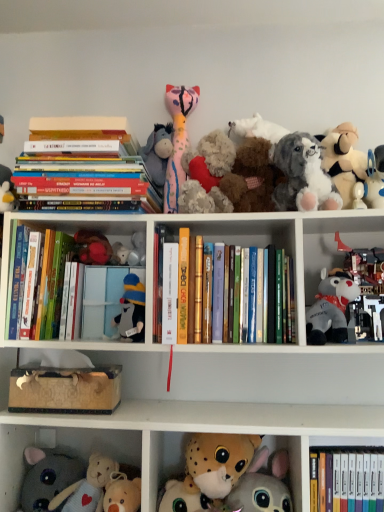
Question: From a real-world perspective, is hardcover book at center, marked as the 2th paperback book in a right-to-left arrangement, located higher than gray plush toy at right, which ranks as the 2th toy in right-to-left order?

Choices:
 (A) no
 (B) yes

Answer: (B)

Question: Is hardcover book at center, which is the first paperback book in left-to-right order, closer to camera compared to gray plush toy at right, which ranks as the 2th toy in right-to-left order?

Choices:
 (A) yes
 (B) no

Answer: (B)

Question: Are hardcover book at center, marked as the 2th paperback book in a right-to-left arrangement, and gray plush toy at right, arranged as the eighth toy when viewed from the left, located far from each other?

Choices:
 (A) no
 (B) yes

Answer: (A)

Question: Is hardcover book at center, marked as the 2th paperback book in a right-to-left arrangement, oriented away from gray plush toy at right, which ranks as the 2th toy in right-to-left order?

Choices:
 (A) yes
 (B) no

Answer: (B)

Question: Does hardcover book at center, which is the first paperback book in left-to-right order, have a greater width compared to gray plush toy at right, arranged as the eighth toy when viewed from the left?

Choices:
 (A) yes
 (B) no

Answer: (A)

Question: From the image's perspective, is hardcover books at center above or below white plush toy at upper right, which is counted as the second cabinet, starting from the left?

Choices:
 (A) above
 (B) below

Answer: (A)

Question: Would you say hardcover books at center is inside or outside white plush toy at upper right, the first cabinet from the right?

Choices:
 (A) inside
 (B) outside

Answer: (B)

Question: From a real-world perspective, is hardcover books at center positioned above or below white plush toy at upper right, the first cabinet in the top-to-bottom sequence?

Choices:
 (A) above
 (B) below

Answer: (A)

Question: In terms of height, does hardcover books at center look taller or shorter compared to white plush toy at upper right, the first cabinet from the right?

Choices:
 (A) tall
 (B) short

Answer: (A)

Question: Is fluffy white plush at lower center, the fifth toy when ordered from left to right, wider or thinner than hardcover books at center, the 2th book viewed from the right?

Choices:
 (A) thin
 (B) wide

Answer: (A)

Question: Is fluffy white plush at lower center, which is the fifth toy from right to left, in front of or behind hardcover books at center, which is the third book from left to right, in the image?

Choices:
 (A) behind
 (B) front

Answer: (A)

Question: From a real-world perspective, relative to hardcover books at center, which is the third book from left to right, is fluffy white plush at lower center, the fifth toy when ordered from left to right, vertically above or below?

Choices:
 (A) below
 (B) above

Answer: (A)

Question: Would you say fluffy white plush at lower center, the fifth toy when ordered from left to right, is inside or outside hardcover books at center, which is the third book from left to right?

Choices:
 (A) outside
 (B) inside

Answer: (A)

Question: Is fluffy plush toy at center, placed as the 7th toy when sorted from right to left, to the left or to the right of fluffy white stuffed animal at upper right, arranged as the ninth toy when viewed from the left, in the image?

Choices:
 (A) right
 (B) left

Answer: (B)

Question: From the image's perspective, is fluffy plush toy at center, which is the third toy from left to right, located above or below fluffy white stuffed animal at upper right, arranged as the ninth toy when viewed from the left?

Choices:
 (A) above
 (B) below

Answer: (B)